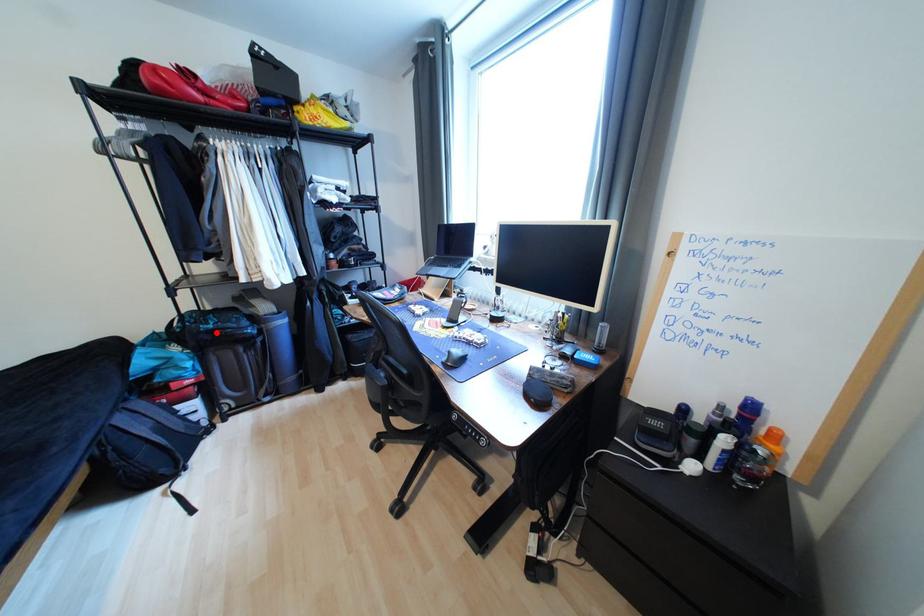
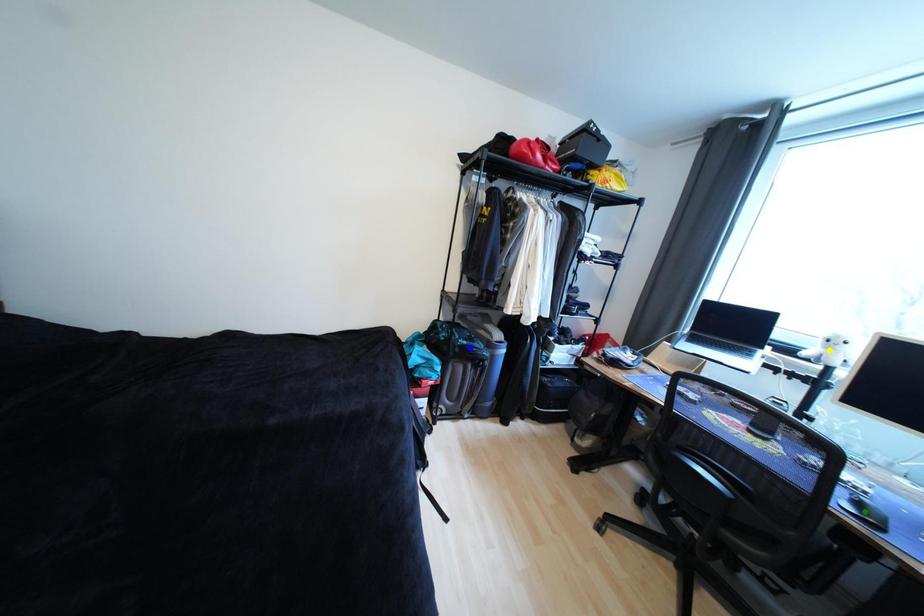
Question: I am providing you with two images of the same scene from different viewpoints. A red point is marked on the first image. You are given multiple points on the second image. Which point in image 2 represents the same 3d spot as the red point in image 1?

Choices:
 (A) green point
 (B) yellow point
 (C) blue point

Answer: (C)